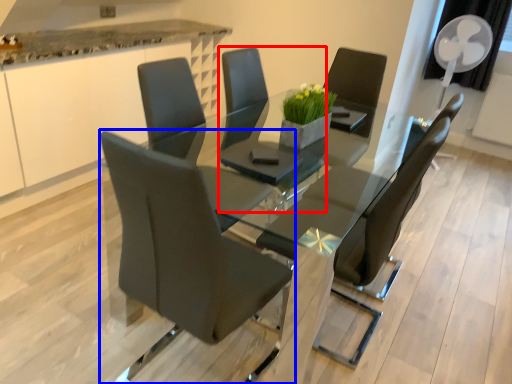
Question: Which of the following is the closest to the observer, chair (highlighted by a red box) or chair (highlighted by a blue box)?

Choices:
 (A) chair
 (B) chair

Answer: (B)